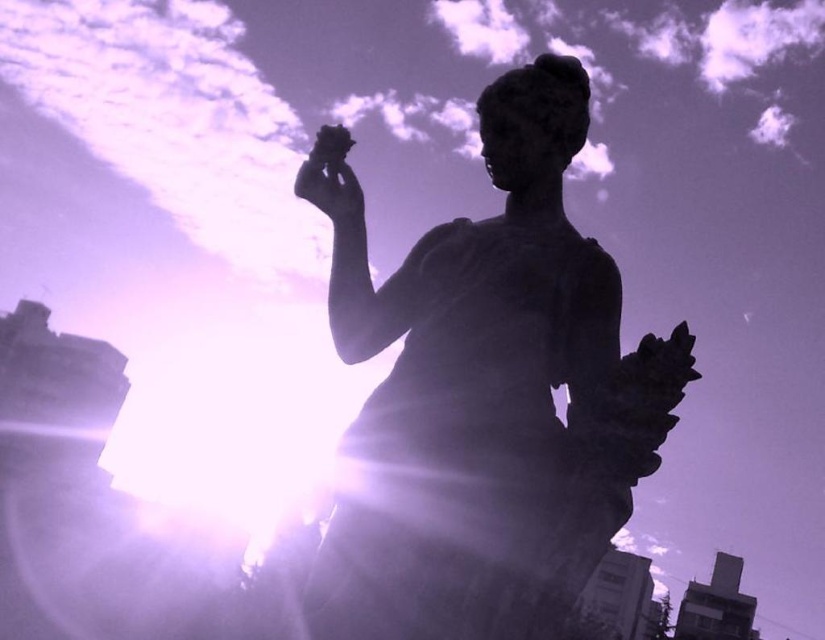
Question: Which point appears farthest from the camera in this image?

Choices:
 (A) (333, 204)
 (B) (376, 419)

Answer: (A)

Question: Which point is closer to the camera taking this photo?

Choices:
 (A) (x=314, y=161)
 (B) (x=528, y=556)

Answer: (B)

Question: Is sculpted stone statue at center to the left of matte black hand at upper center from the viewer's perspective?

Choices:
 (A) yes
 (B) no

Answer: (B)

Question: Does sculpted stone statue at center have a lesser width compared to matte black hand at upper center?

Choices:
 (A) yes
 (B) no

Answer: (B)

Question: Is the position of sculpted stone statue at center more distant than that of matte black hand at upper center?

Choices:
 (A) yes
 (B) no

Answer: (B)